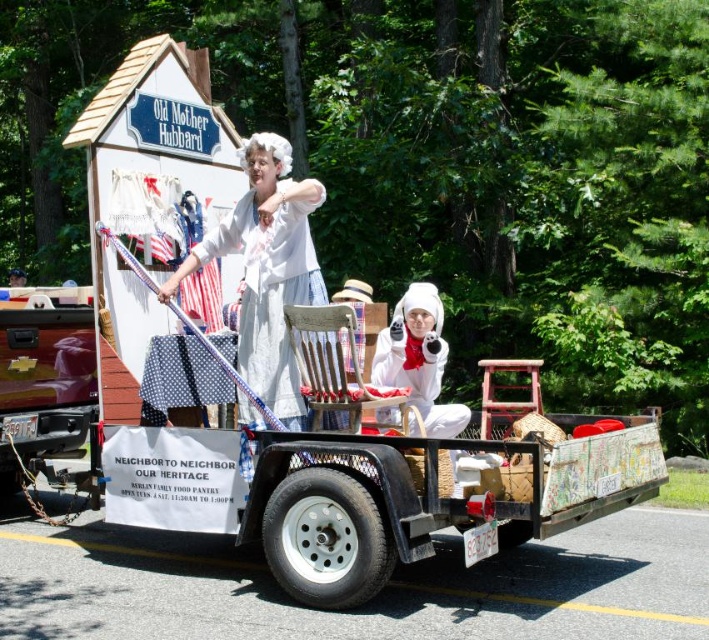
You are a photographer at the festival and want to capture both the white cotton dress at center and the white fluffy costume at center in the same frame. Since they are both at the center, which one should you position to the left in your camera view to ensure both are visible?

The white cotton dress at center is already positioned to the left of the white fluffy costume at center, so you should keep the white cotton dress at center on the left side of the frame to include both in the photo.

You are a photographer trying to capture a clear shot of both the white cotton dress at center and the white fluffy costume at center. Since you want to ensure both are fully visible in the frame, which object should you position closer to the camera to avoid cropping?

You should position the white cotton dress at center closer to the camera because it might be wider than the white fluffy costume at center, ensuring both fit within the frame without cropping.

Where is the white cotton dress at center located in the image?

The white cotton dress at center is located at point [267,269].